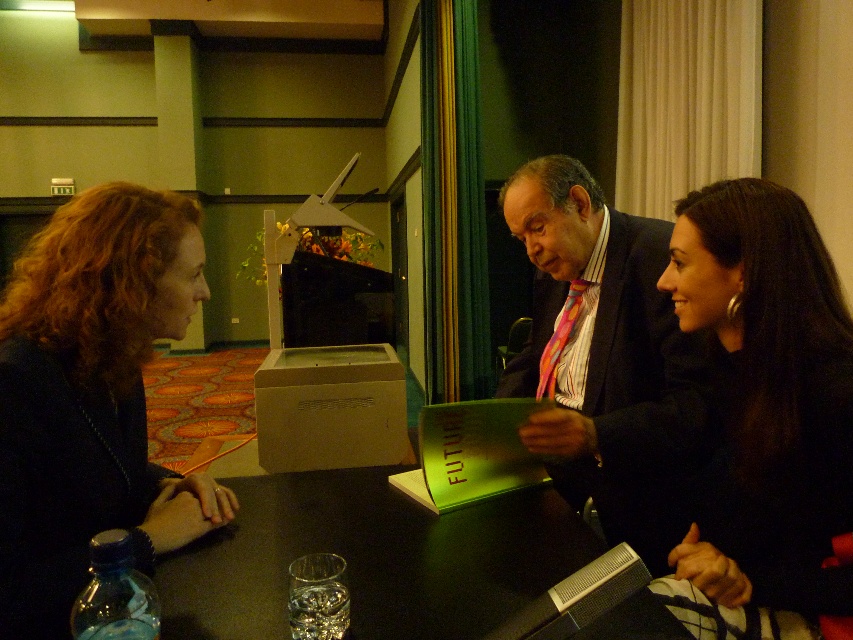
Question: Can you confirm if shiny black hair at center is thinner than multicolored striped tie at center?

Choices:
 (A) yes
 (B) no

Answer: (A)

Question: Which point is closer to the camera?

Choices:
 (A) (186, 248)
 (B) (807, 266)

Answer: (B)

Question: Which object is positioned farthest from the multicolored striped tie at center?

Choices:
 (A) shiny black hair at center
 (B) dark brown hair at left

Answer: (B)

Question: Where is shiny black hair at center located in relation to multicolored striped tie at center in the image?

Choices:
 (A) right
 (B) left

Answer: (A)

Question: Which point appears farthest from the camera in this image?

Choices:
 (A) coord(749,572)
 (B) coord(630,472)

Answer: (B)

Question: Observing the image, what is the correct spatial positioning of shiny black hair at center in reference to multicolored striped tie at center?

Choices:
 (A) right
 (B) left

Answer: (A)